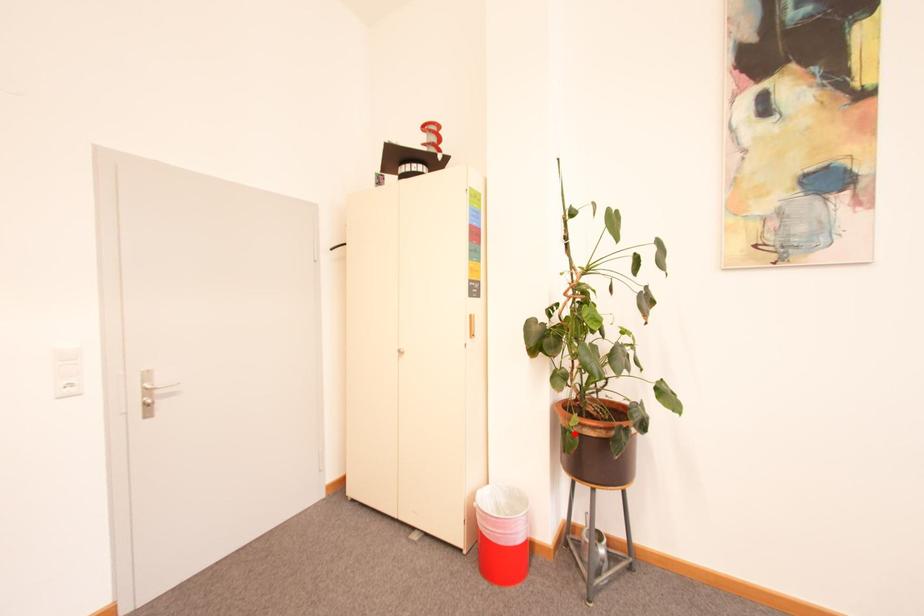
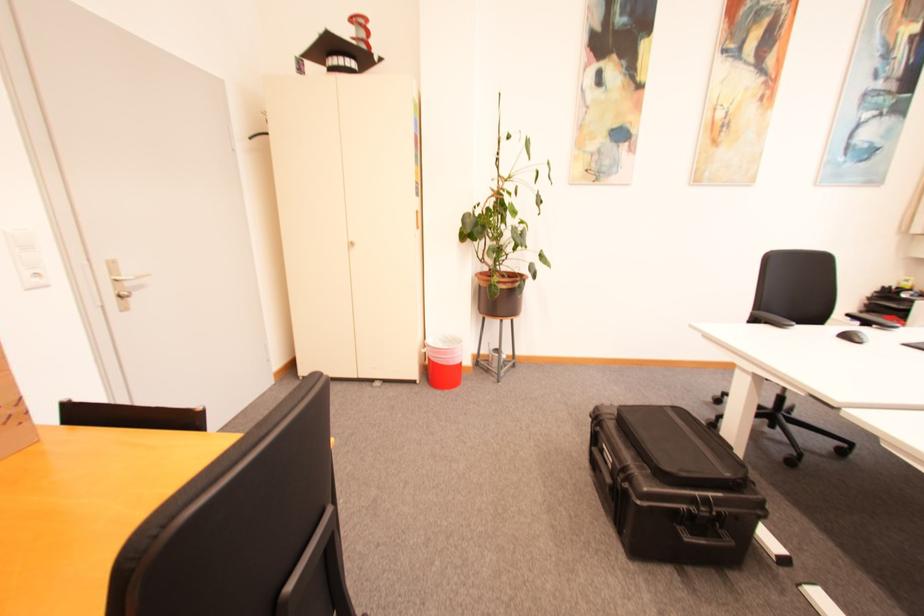
Find the pixel in the second image that matches the highlighted location in the first image.

(500, 286)